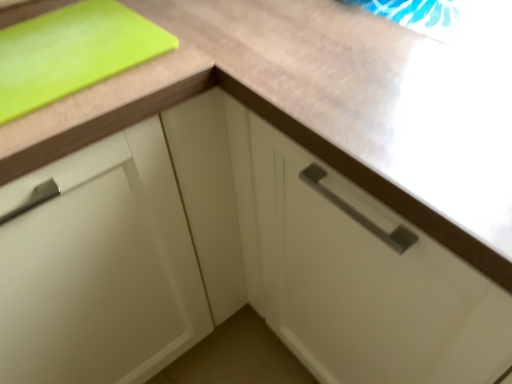
In order to face green matte cutting board at upper left, should I rotate leftwards or rightwards?

A 27.103 degree turn to the left will do.

This screenshot has height=384, width=512. Describe the element at coordinates (72, 52) in the screenshot. I see `green matte cutting board at upper left` at that location.

This screenshot has height=384, width=512. What are the coordinates of `green matte cutting board at upper left` in the screenshot? It's located at (72, 52).

From the picture: What is the approximate width of green matte cutting board at upper left?

It is 9.74 inches.

What is the approximate height of green matte cutting board at upper left?

green matte cutting board at upper left is 1.89 centimeters tall.

What is the approximate height of matte white cabinet at left?

It is 34.33 inches.

Describe the element at coordinates (99, 267) in the screenshot. Image resolution: width=512 pixels, height=384 pixels. I see `matte white cabinet at left` at that location.

This screenshot has height=384, width=512. Identify the location of matte white cabinet at left. (99, 267).

You are a GUI agent. You are given a task and a screenshot of the screen. Output one action in this format:
    pyautogui.click(x=<x>, y=<y>)
    Task: Click on the green matte cutting board at upper left
    
    Given the screenshot: What is the action you would take?
    pyautogui.click(x=72, y=52)

Can you confirm if green matte cutting board at upper left is positioned to the right of matte white cabinet at left?

Yes, green matte cutting board at upper left is to the right of matte white cabinet at left.

Is green matte cutting board at upper left behind matte white cabinet at left?

Yes, it is behind matte white cabinet at left.

Considering the positions of point (56, 78) and point (127, 381), is point (56, 78) closer or farther from the camera than point (127, 381)?

Clearly, point (56, 78) is closer to the camera than point (127, 381).

From the image's perspective, between green matte cutting board at upper left and matte white cabinet at left, which one is located above?

green matte cutting board at upper left.

From a real-world perspective, is green matte cutting board at upper left physically below matte white cabinet at left?

No.

Which object is wider, green matte cutting board at upper left or matte white cabinet at left?

matte white cabinet at left is wider.

Who is taller, green matte cutting board at upper left or matte white cabinet at left?

With more height is matte white cabinet at left.

Considering the sizes of green matte cutting board at upper left and matte white cabinet at left in the image, is green matte cutting board at upper left bigger or smaller than matte white cabinet at left?

In the image, green matte cutting board at upper left appears to be smaller than matte white cabinet at left.

Is green matte cutting board at upper left not within matte white cabinet at left?

No.

Is green matte cutting board at upper left not near matte white cabinet at left?

green matte cutting board at upper left is actually quite close to matte white cabinet at left.

Is green matte cutting board at upper left looking in the opposite direction of matte white cabinet at left?

Yes, green matte cutting board at upper left is positioned with its back facing matte white cabinet at left.

Where is `cutting board lying behind the matte white cabinet at left`? The image size is (512, 384). cutting board lying behind the matte white cabinet at left is located at coordinates (72, 52).

Which is more to the left, matte white cabinet at left or green matte cutting board at upper left?

matte white cabinet at left is more to the left.

Relative to green matte cutting board at upper left, is matte white cabinet at left in front or behind?

Clearly, matte white cabinet at left is in front of green matte cutting board at upper left.

Is point (89, 335) closer or farther from the camera than point (84, 31)?

Point (89, 335).

From the image's perspective, which one is positioned lower, matte white cabinet at left or green matte cutting board at upper left?

matte white cabinet at left, from the image's perspective.

From a real-world perspective, between matte white cabinet at left and green matte cutting board at upper left, who is vertically lower?

matte white cabinet at left, from a real-world perspective.

Which of these two, matte white cabinet at left or green matte cutting board at upper left, is wider?

matte white cabinet at left.

Considering the sizes of matte white cabinet at left and green matte cutting board at upper left in the image, is matte white cabinet at left taller or shorter than green matte cutting board at upper left?

Clearly, matte white cabinet at left is taller compared to green matte cutting board at upper left.

Does matte white cabinet at left have a larger size compared to green matte cutting board at upper left?

Correct, matte white cabinet at left is larger in size than green matte cutting board at upper left.

Does matte white cabinet at left contain green matte cutting board at upper left?

Yes, matte white cabinet at left is surrounding green matte cutting board at upper left.

Based on the photo, are matte white cabinet at left and green matte cutting board at upper left far apart?

matte white cabinet at left is actually quite close to green matte cutting board at upper left.

Is matte white cabinet at left turned away from green matte cutting board at upper left?

No, matte white cabinet at left is not facing the opposite direction of green matte cutting board at upper left.

What's the angular difference between matte white cabinet at left and green matte cutting board at upper left's facing directions?

The angle between the facing direction of matte white cabinet at left and the facing direction of green matte cutting board at upper left is 1.08 degrees.

Identify the location of cutting board on the right of matte white cabinet at left. The width and height of the screenshot is (512, 384). 72,52.

Identify the location of cutting board behind the matte white cabinet at left. (72, 52).

I want to click on cutting board that is on the right side of matte white cabinet at left, so click(72, 52).